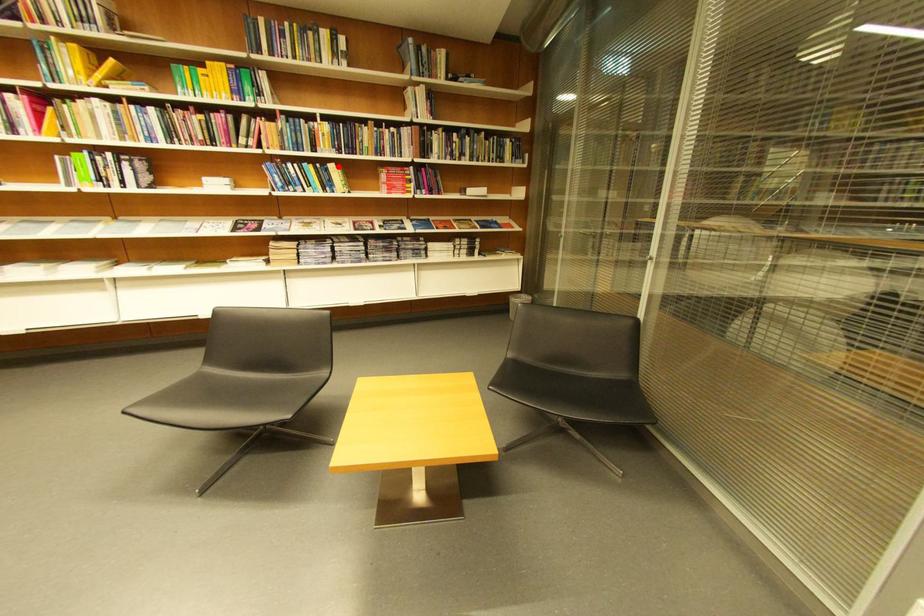
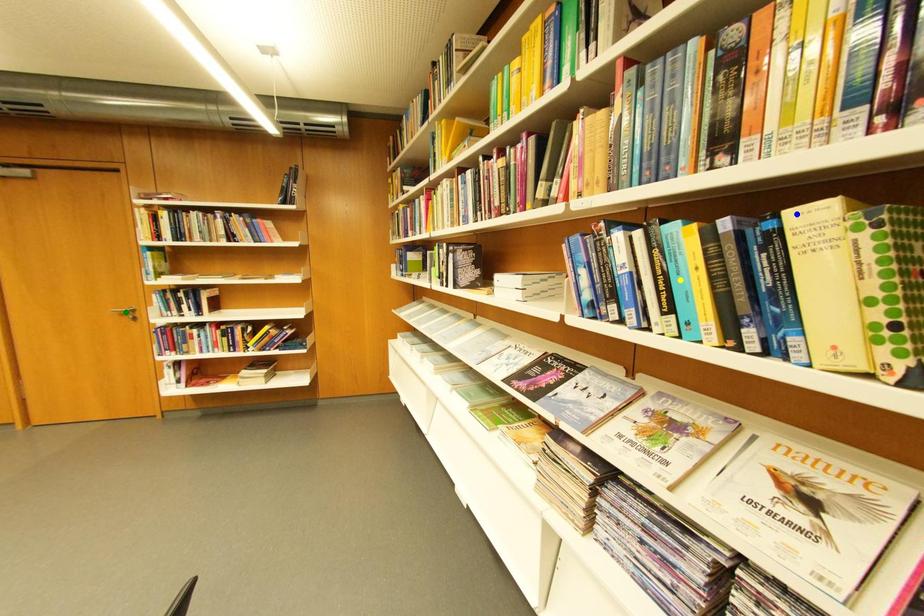
Question: I am providing you with two images of the same scene from different viewpoints. A red point is marked on the first image. You are given multiple points on the second image. Can you choose the point in image 2 that corresponds to the point in image 1?

Choices:
 (A) green point
 (B) yellow point
 (C) blue point

Answer: (C)